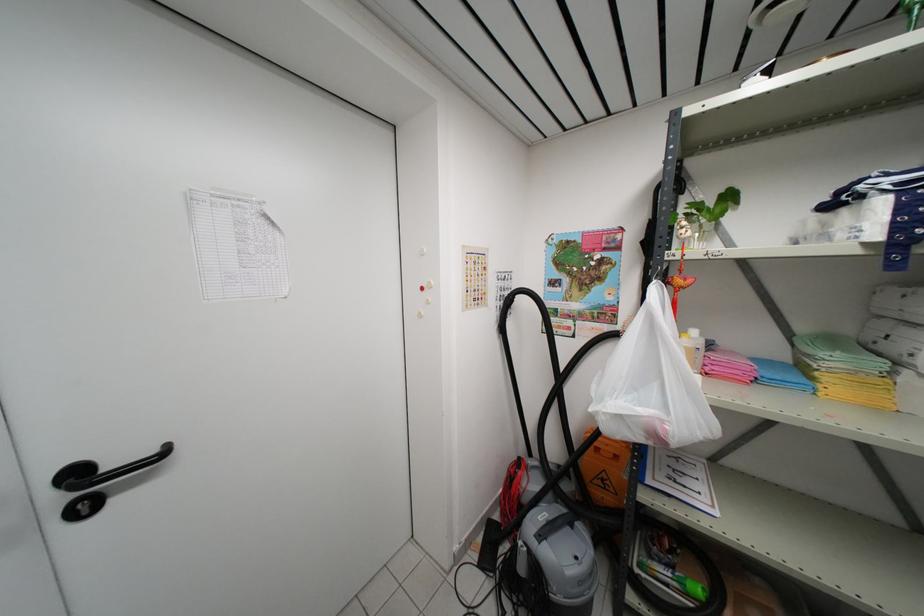
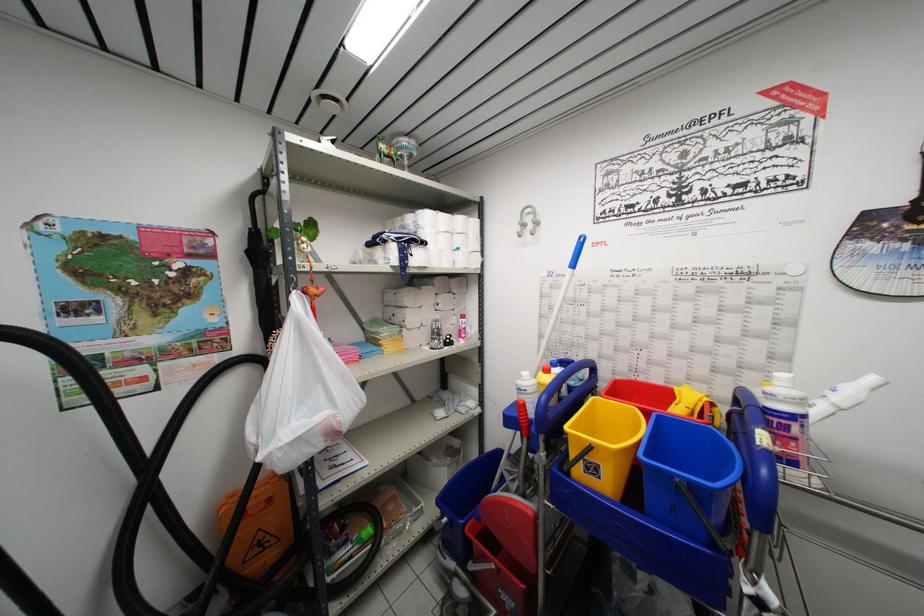
In the second image, find the point that corresponds to (x=646, y=246) in the first image.

(250, 257)